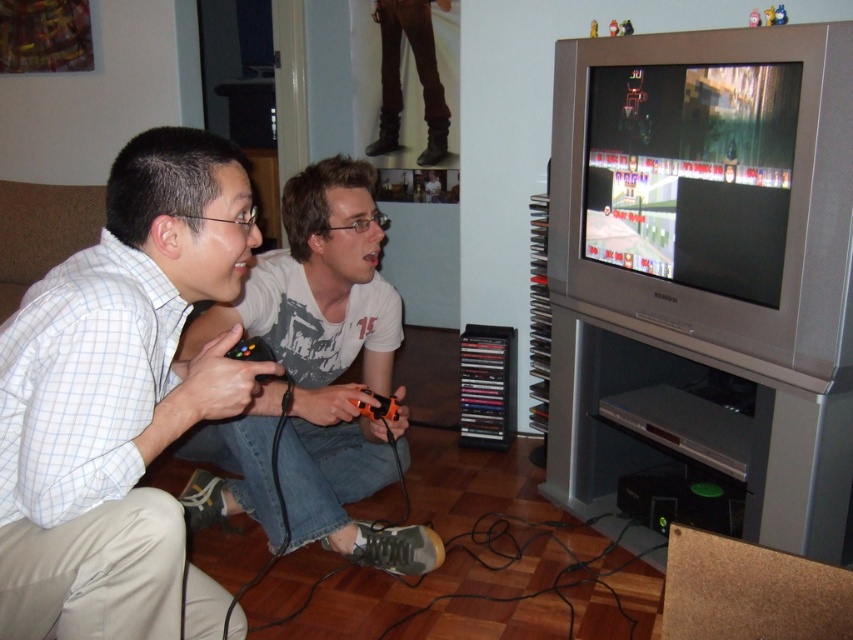
Question: Which object appears farthest from the camera in this image?

Choices:
 (A) matte gray shirt at center
 (B) light blue checkered shirt at lower left

Answer: (A)

Question: Among these objects, which one is nearest to the camera?

Choices:
 (A) light blue checkered shirt at lower left
 (B) matte gray shirt at center

Answer: (A)

Question: Is light blue checkered shirt at lower left behind matte gray shirt at center?

Choices:
 (A) yes
 (B) no

Answer: (B)

Question: Can you confirm if light blue checkered shirt at lower left is smaller than matte gray shirt at center?

Choices:
 (A) no
 (B) yes

Answer: (B)

Question: Is light blue checkered shirt at lower left below matte gray shirt at center?

Choices:
 (A) no
 (B) yes

Answer: (A)